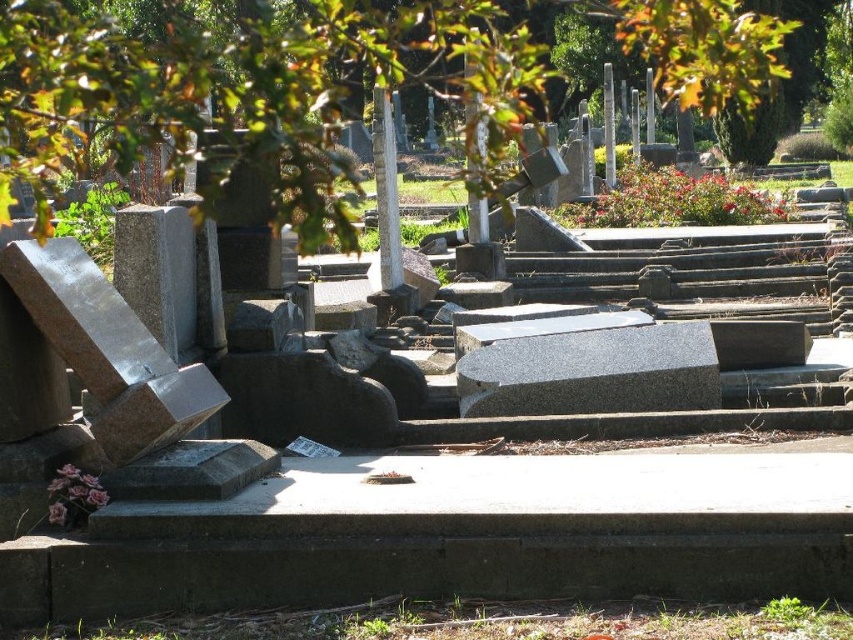
Is green leafy tree at upper center positioned at the back of granite at center?

No, it is in front of granite at center.

I want to click on green leafy tree at upper center, so click(x=247, y=90).